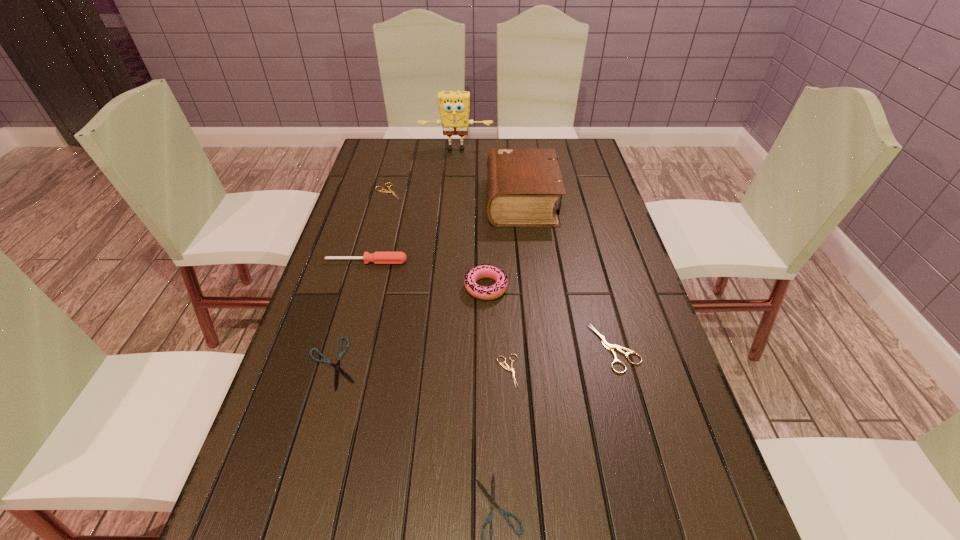
Locate an element on the screen. The height and width of the screenshot is (540, 960). vacant space located on the back of the tallest shears is located at coordinates (589, 255).

Identify the location of free space located 0.120m on the front of the farthest beige shears. The image size is (960, 540). (381, 223).

You are a GUI agent. You are given a task and a screenshot of the screen. Output one action in this format:
    pyautogui.click(x=<x>, y=<y>)
    Task: Click on the free point located 0.310m on the right of the bigger black shears
    
    Given the screenshot: What is the action you would take?
    pyautogui.click(x=495, y=363)

The height and width of the screenshot is (540, 960). In order to click on free space located 0.300m on the left of the second beige shears from right to left in this screenshot , I will do [364, 371].

Where is `object that is at the far edge`? The image size is (960, 540). object that is at the far edge is located at coordinates (454, 106).

At what (x,y) coordinates should I click in order to perform the action: click on screwdriver positioned at the left edge. Please return your answer as a coordinate pair (x, y). Looking at the image, I should click on (377, 257).

At what (x,y) coordinates should I click in order to perform the action: click on object present at the right edge. Please return your answer as a coordinate pair (x, y). The width and height of the screenshot is (960, 540). Looking at the image, I should click on (608, 346).

Locate an element on the screen. blank space at the far edge of the desktop is located at coordinates (445, 161).

Image resolution: width=960 pixels, height=540 pixels. What are the coordinates of `vacant point at the left edge` in the screenshot? It's located at (372, 276).

In the image, there is a desktop. Identify the location of free space at the right edge. (691, 527).